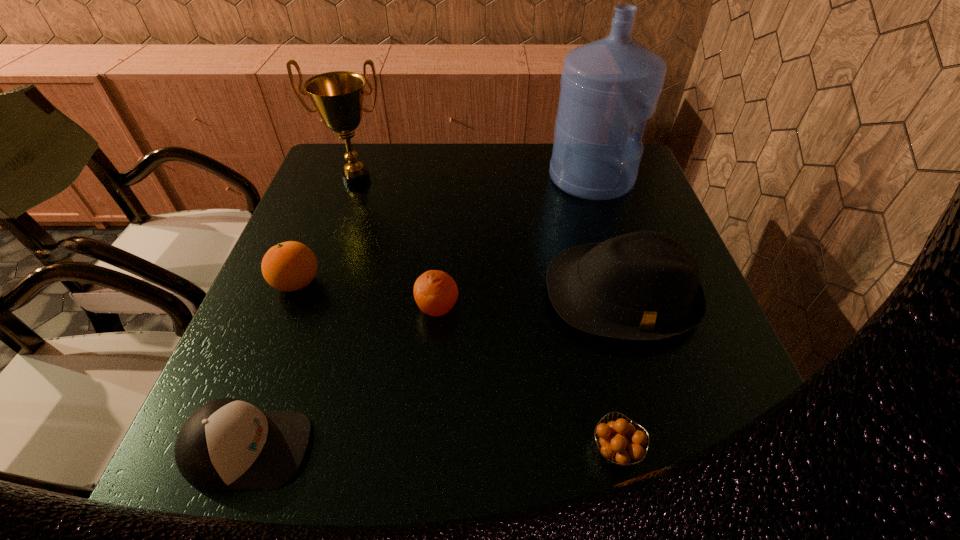
What are the coordinates of `object that is the third closest to the cap` in the screenshot? It's located at (643, 286).

Select which orange fruit appears as the closest to the sixth shortest object. Please provide its 2D coordinates. Your answer should be formatted as a tuple, i.e. [(x, y)], where the tuple contains the x and y coordinates of a point satisfying the conditions above.

[(289, 266)]

Find the location of a particular element. orange fruit that is the nearest to the cap is located at coordinates (435, 292).

Find the location of a particular element. Image resolution: width=960 pixels, height=540 pixels. vacant region that satisfies the following two spatial constraints: 1. on the front view with handles of the sixth shortest object; 2. on the right side of the second orange fruit from left to right is located at coordinates (312, 308).